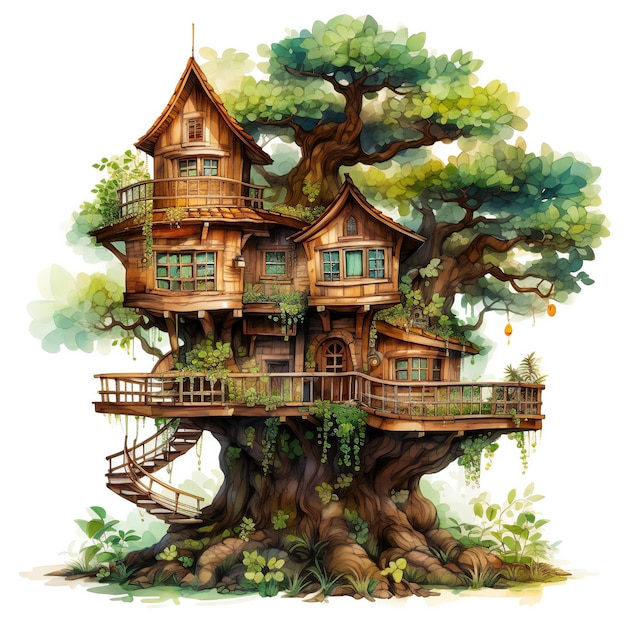
Where is `yellow hanging objects`? This screenshot has height=626, width=626. yellow hanging objects is located at coordinates (506, 327), (550, 312).